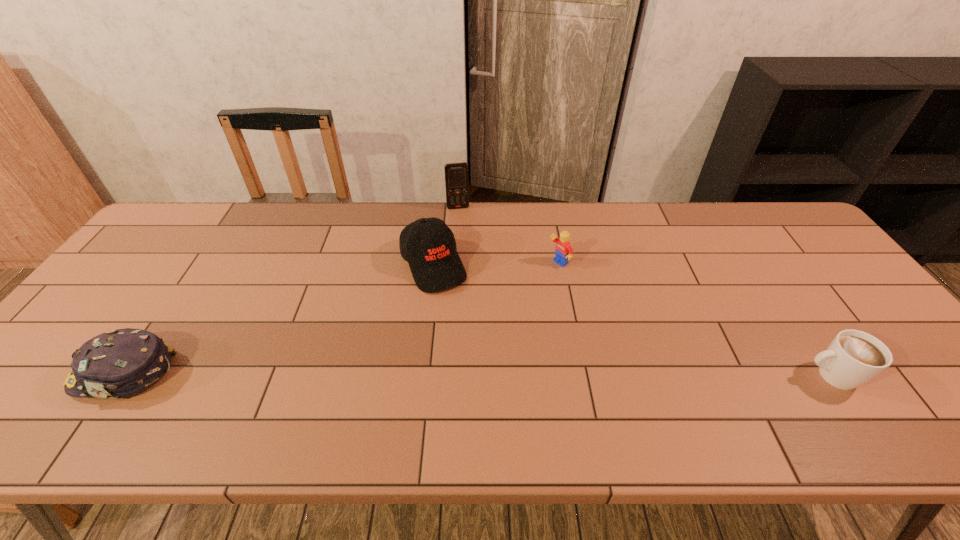
What are the coordinates of `blank area at the far right corner` in the screenshot? It's located at (807, 243).

The width and height of the screenshot is (960, 540). Find the location of `free point between the tallest object and the headwear`. free point between the tallest object and the headwear is located at coordinates (291, 291).

This screenshot has height=540, width=960. Find the location of `vacant area between the rightmost object and the baseball cap`. vacant area between the rightmost object and the baseball cap is located at coordinates (x=633, y=320).

Identify the location of free spot between the headwear and the baseball cap. (278, 319).

Where is `vacant area that lies between the tallest object and the leftmost object`? The image size is (960, 540). vacant area that lies between the tallest object and the leftmost object is located at coordinates [x=291, y=291].

You are a GUI agent. You are given a task and a screenshot of the screen. Output one action in this format:
    pyautogui.click(x=<x>, y=<y>)
    Task: Click on the blank region between the tallest object and the Lego
    
    Given the screenshot: What is the action you would take?
    pyautogui.click(x=508, y=235)

The image size is (960, 540). In order to click on empty space between the baseball cap and the headwear in this screenshot , I will do `click(278, 319)`.

Locate an element on the screen. This screenshot has width=960, height=540. free spot between the headwear and the fourth object from left to right is located at coordinates (341, 319).

The image size is (960, 540). Find the location of `vacant space that's between the rightmost object and the baseball cap`. vacant space that's between the rightmost object and the baseball cap is located at coordinates (633, 320).

You are a GUI agent. You are given a task and a screenshot of the screen. Output one action in this format:
    pyautogui.click(x=<x>, y=<y>)
    Task: Click on the vacant point located between the rightmost object and the cellular telephone
    This screenshot has height=540, width=960.
    Given the screenshot: What is the action you would take?
    pyautogui.click(x=644, y=292)